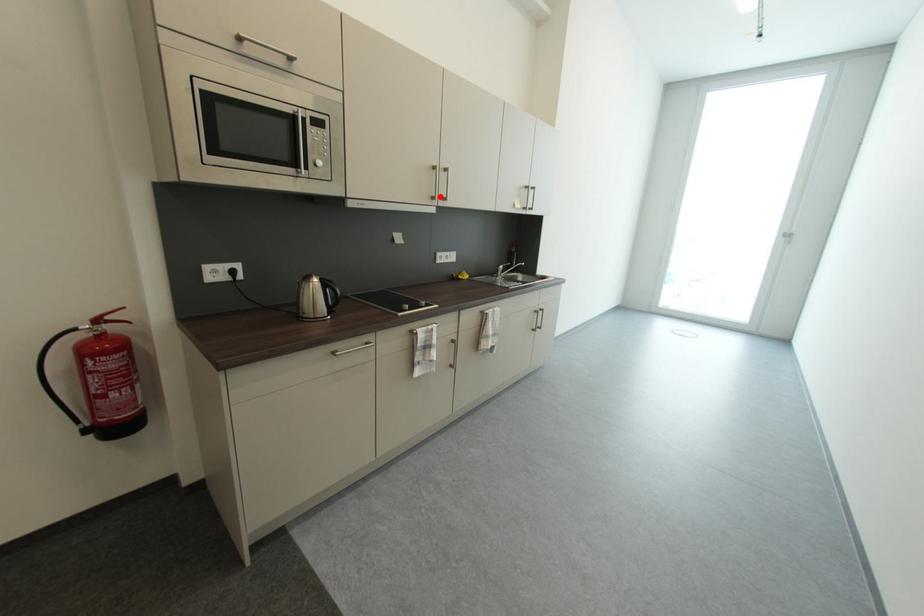
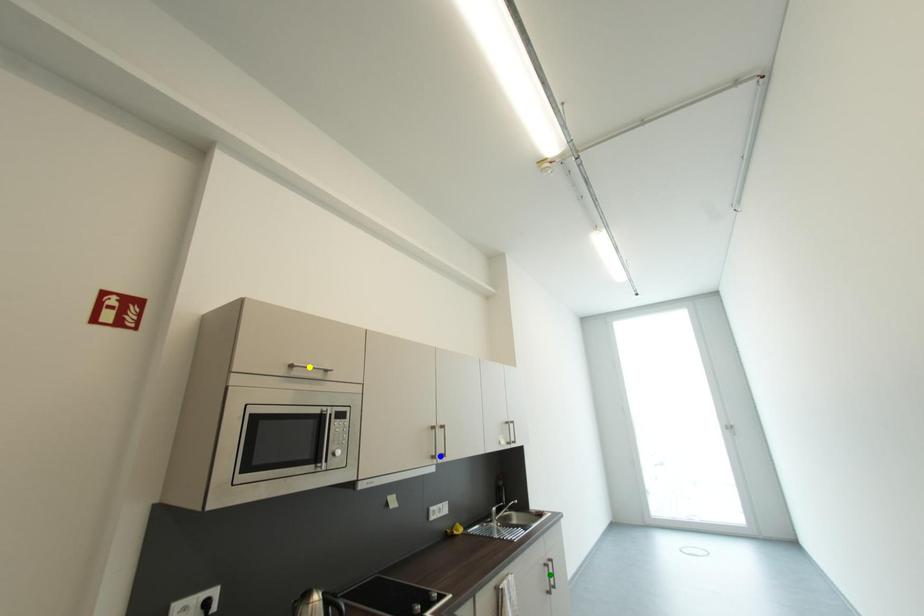
Question: I am providing you with two images of the same scene from different viewpoints. A red point is marked on the first image. You are given multiple points on the second image. Can you choose the point in image 2 that corresponds to the point in image 1?

Choices:
 (A) yellow point
 (B) blue point
 (C) green point

Answer: (B)